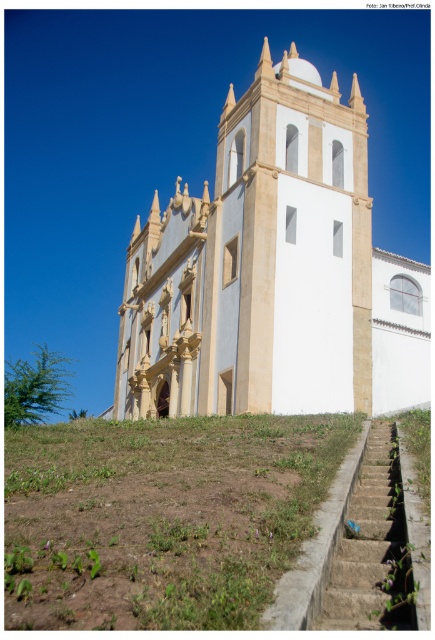
Question: Is green grass at lower left wider than concrete stairs at lower right?

Choices:
 (A) no
 (B) yes

Answer: (B)

Question: Is green grass at lower left further to camera compared to concrete stairs at lower right?

Choices:
 (A) yes
 (B) no

Answer: (B)

Question: Which point appears farthest from the camera in this image?

Choices:
 (A) (311, 300)
 (B) (401, 586)

Answer: (A)

Question: Which object is positioned closest to the concrete stairs at lower right?

Choices:
 (A) white smooth church at center
 (B) green grass at lower left

Answer: (B)

Question: Is white smooth church at center thinner than concrete stairs at lower right?

Choices:
 (A) no
 (B) yes

Answer: (A)

Question: Among these objects, which one is farthest from the camera?

Choices:
 (A) white smooth church at center
 (B) green grass at lower left
 (C) concrete stairs at lower right

Answer: (A)